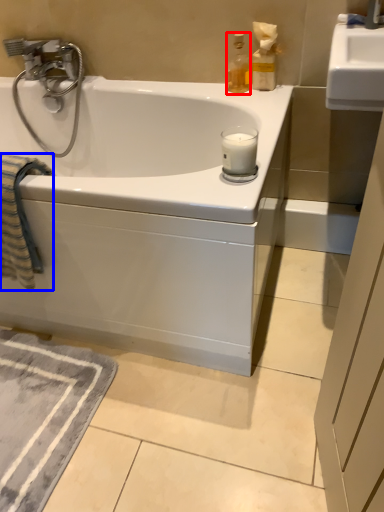
Question: Which object appears farthest to the camera in this image, bottle (highlighted by a red box) or beach towel (highlighted by a blue box)?

Choices:
 (A) bottle
 (B) beach towel

Answer: (A)